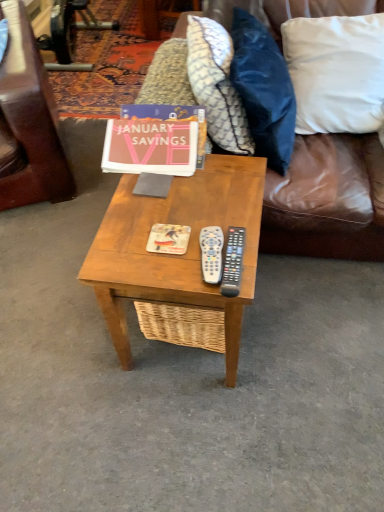
Find the location of `empty space that is to the right of matte orange magazine at center`. empty space that is to the right of matte orange magazine at center is located at coordinates (230, 215).